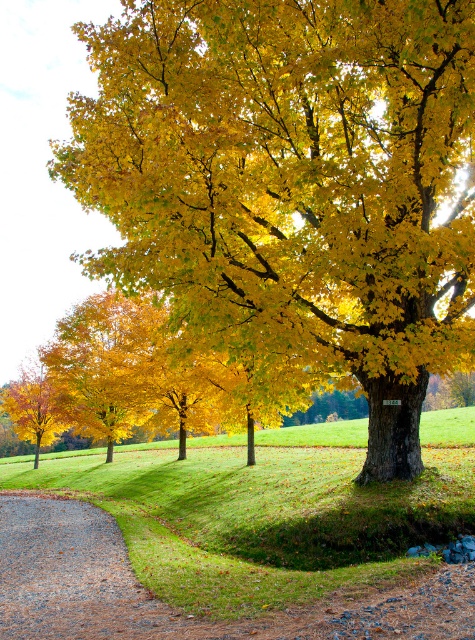
Question: Which point is farther to the camera?

Choices:
 (A) gravelly dirt path at lower left
 (B) golden matte tree at center

Answer: (B)

Question: Observing the image, what is the correct spatial positioning of golden matte tree at center in reference to gravelly dirt path at lower left?

Choices:
 (A) below
 (B) above

Answer: (B)

Question: Which point is farther to the camera?

Choices:
 (A) (414, 72)
 (B) (105, 556)

Answer: (B)

Question: Does golden matte tree at center have a smaller size compared to gravelly dirt path at lower left?

Choices:
 (A) no
 (B) yes

Answer: (A)

Question: Does golden matte tree at center appear under gravelly dirt path at lower left?

Choices:
 (A) yes
 (B) no

Answer: (B)

Question: Among these points, which one is farthest from the camera?

Choices:
 (A) (143, 228)
 (B) (143, 609)

Answer: (A)